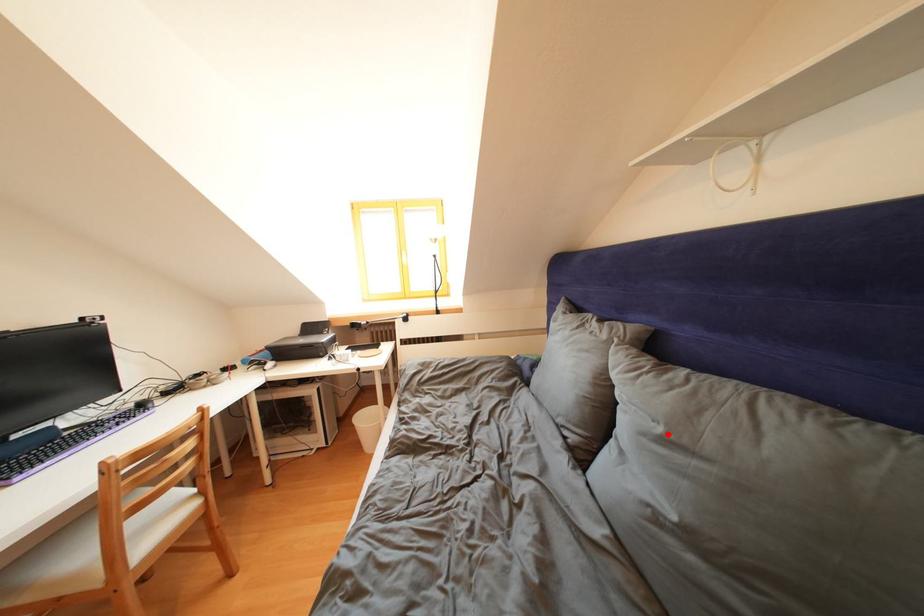
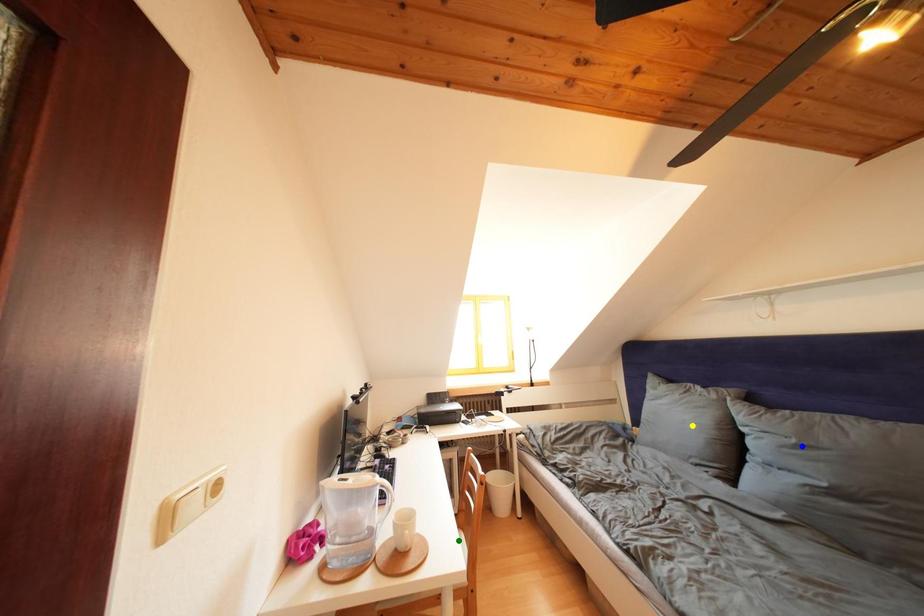
Question: I am providing you with two images of the same scene from different viewpoints. A red point is marked on the first image. You are given multiple points on the second image. Which point in image 2 is actually the same real-world point as the red point in image 1?

Choices:
 (A) green point
 (B) yellow point
 (C) blue point

Answer: (C)